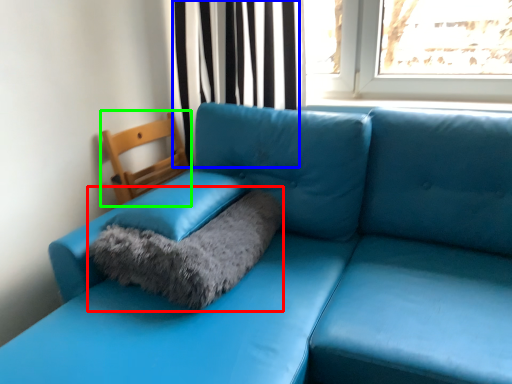
Question: Which object is positioned farthest from cat bed (highlighted by a red box)? Select from curtain (highlighted by a blue box) and armchair (highlighted by a green box).

Choices:
 (A) curtain
 (B) armchair

Answer: (A)